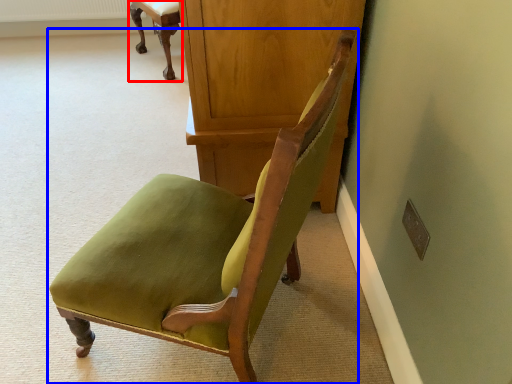
Question: Which object appears farthest to the camera in this image, chair (highlighted by a red box) or chair (highlighted by a blue box)?

Choices:
 (A) chair
 (B) chair

Answer: (A)